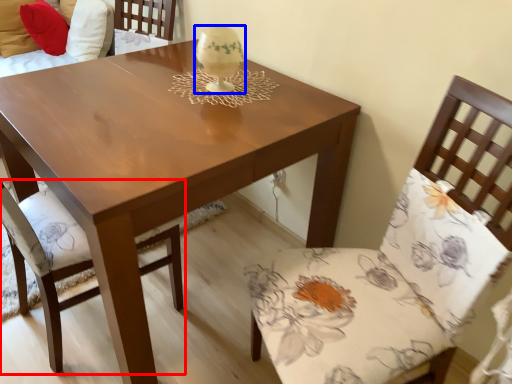
Question: Which of the following is the farthest to the observer, chair (highlighted by a red box) or candle holder (highlighted by a blue box)?

Choices:
 (A) chair
 (B) candle holder

Answer: (B)